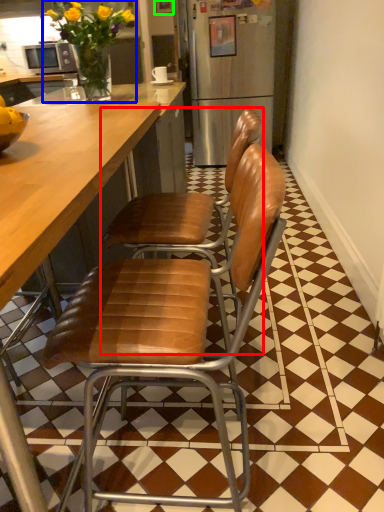
Question: Which object is the farthest from chair (highlighted by a red box)? Choose among these: houseplant (highlighted by a blue box) or picture frame (highlighted by a green box).

Choices:
 (A) houseplant
 (B) picture frame

Answer: (B)